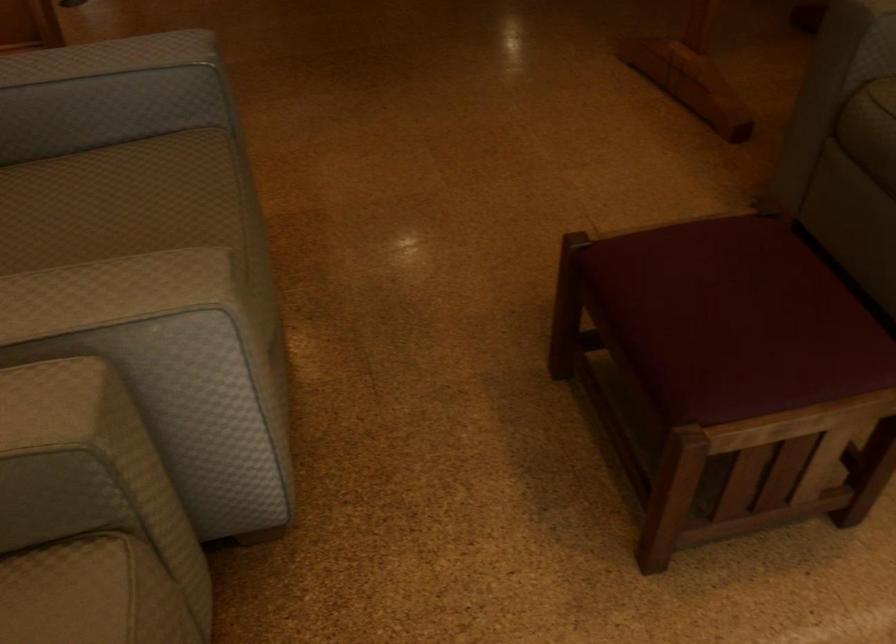
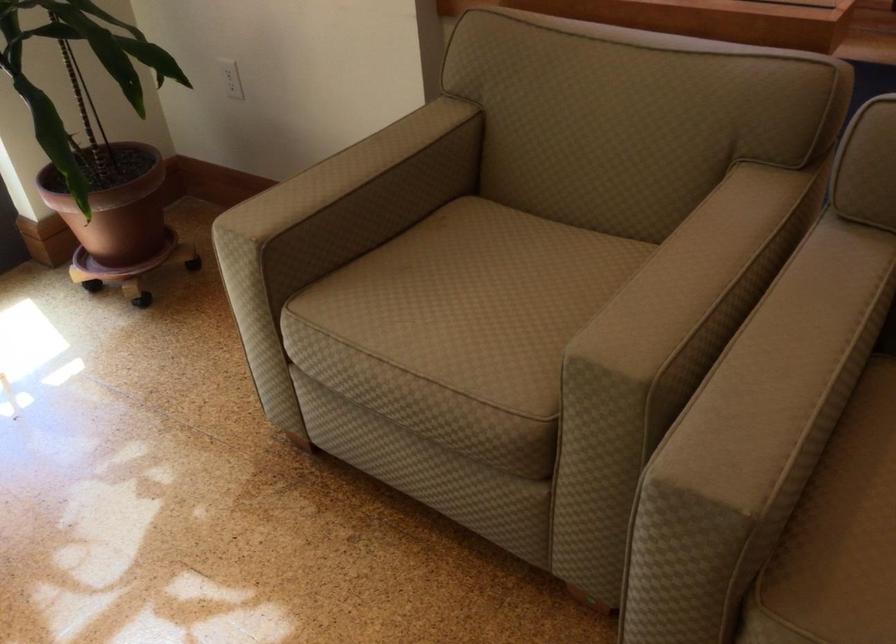
In the second image, find the point that corresponds to the point at 113,301 in the first image.

(862, 504)